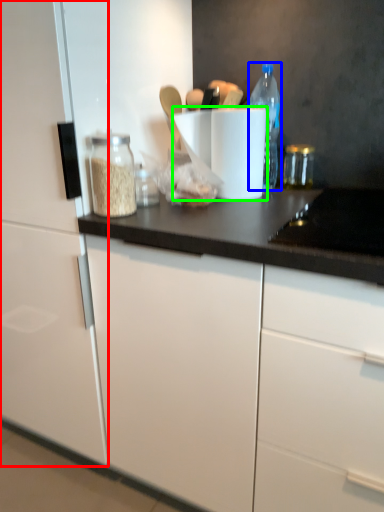
Question: Which object is the farthest from cabinetry (highlighted by a red box)? Choose among these: bottle (highlighted by a blue box) or paper towel (highlighted by a green box).

Choices:
 (A) bottle
 (B) paper towel

Answer: (A)